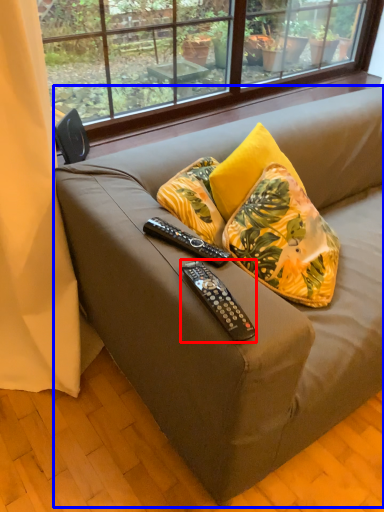
Question: Which object is further to the camera taking this photo, remote control (highlighted by a red box) or studio couch (highlighted by a blue box)?

Choices:
 (A) remote control
 (B) studio couch

Answer: (A)